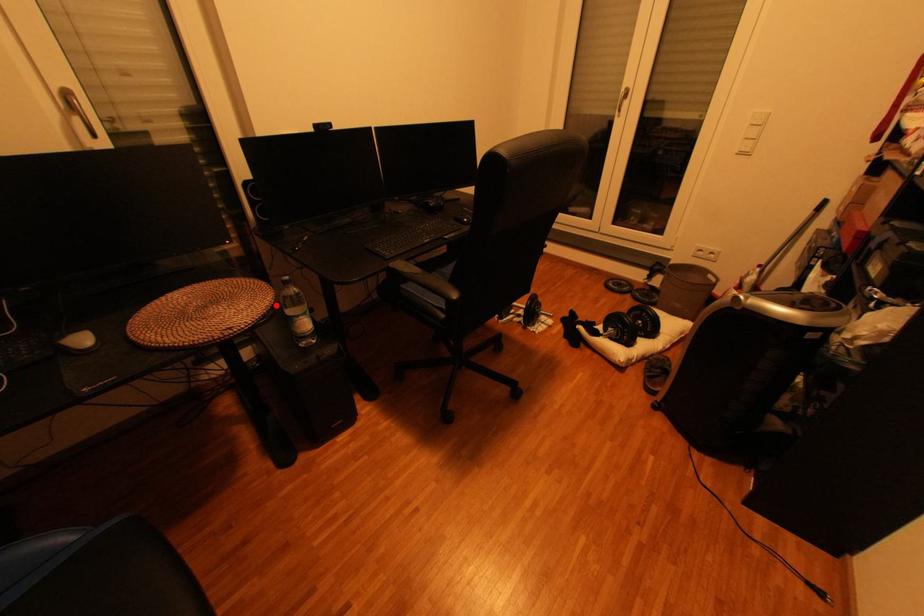
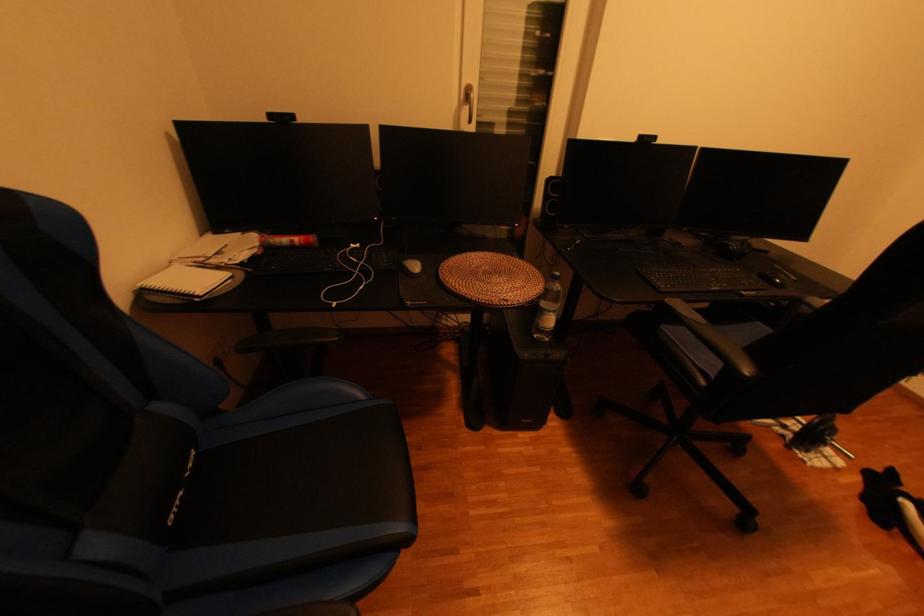
Question: I am providing you with two images of the same scene from different viewpoints. Given a red point in image1, look at the same physical point in image2. Is it:

Choices:
 (A) Closer to the viewpoint
 (B) Farther from the viewpoint

Answer: (B)